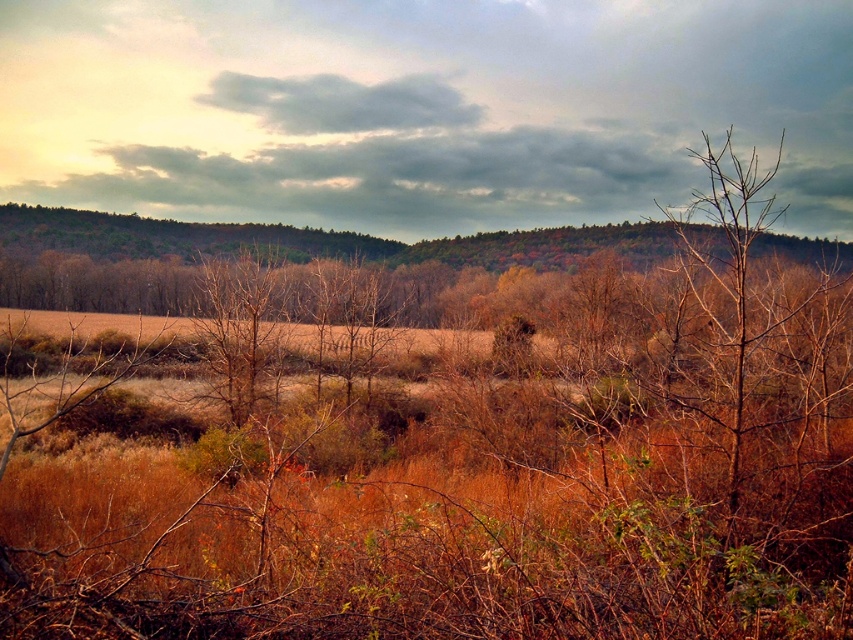
Who is positioned more to the right, bare branches at right or brown dry tree at center?

Positioned to the right is bare branches at right.

Image resolution: width=853 pixels, height=640 pixels. Describe the element at coordinates (733, 269) in the screenshot. I see `bare branches at right` at that location.

Where is `bare branches at right`? bare branches at right is located at coordinates (733, 269).

I want to click on bare branches at right, so click(733, 269).